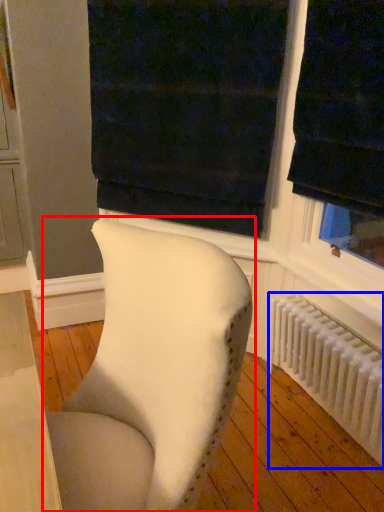
Question: Among these objects, which one is nearest to the camera, chair (highlighted by a red box) or radiator (highlighted by a blue box)?

Choices:
 (A) chair
 (B) radiator

Answer: (A)